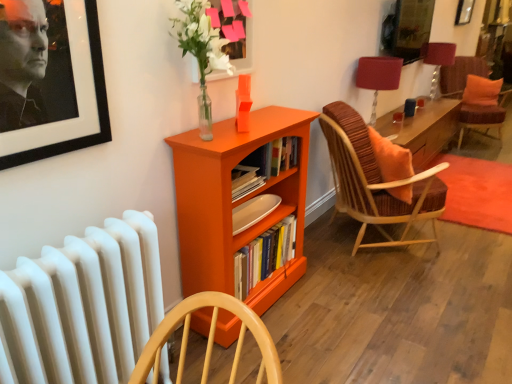
Question: From a real-world perspective, is white matte radiator at lower left physically located above or below wooden woven chair with orange cushion at right, the 2th chair positioned from the top?

Choices:
 (A) below
 (B) above

Answer: (B)

Question: Is white matte radiator at lower left inside or outside of wooden woven chair with orange cushion at right, arranged as the second chair when viewed from the back?

Choices:
 (A) outside
 (B) inside

Answer: (A)

Question: Which object is positioned farthest from the matte red lampshade at upper right, the second table lamp from the top?

Choices:
 (A) white matte radiator at lower left
 (B) wooden woven chair with orange cushion at right, the 2th chair positioned from the top
 (C) matte glass picture frame at upper center
 (D) velvet orange cushion at right, acting as the second chair starting from the bottom
 (E) matte red lampshade at upper right, the 2th table lamp from the bottom

Answer: (D)

Question: Which object is the closest to the matte red lampshade at upper right, which is the 2th table lamp from right to left?

Choices:
 (A) hardcover books at center
 (B) wooden woven chair with orange cushion at right, the 2th chair positioned from the top
 (C) orange matte bookcase at center
 (D) orange fabric pillow at upper right
 (E) matte red lampshade at upper right, which is counted as the 1th table lamp, starting from the back

Answer: (B)